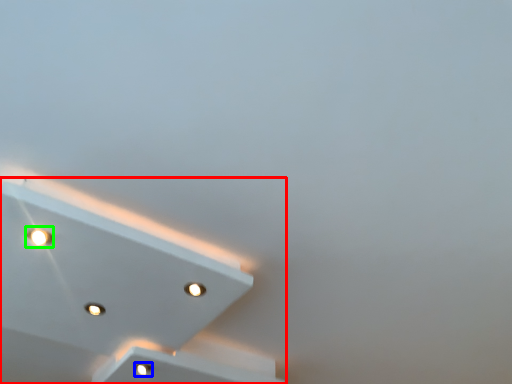
Question: Which is nearer to the lamp (highlighted by a red box)? dot (highlighted by a blue box) or dot (highlighted by a green box).

Choices:
 (A) dot
 (B) dot

Answer: (A)